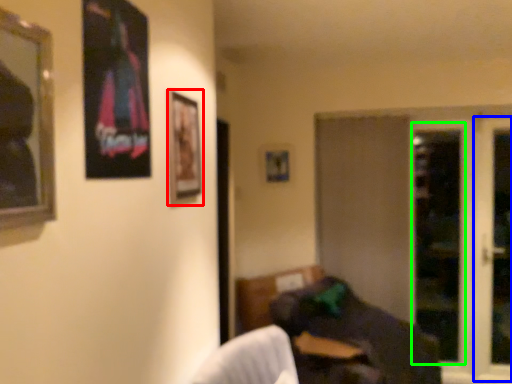
Question: Which object is positioned closest to picture frame (highlighted by a red box)? Select from screen door (highlighted by a blue box) and screen door (highlighted by a green box).

Choices:
 (A) screen door
 (B) screen door

Answer: (B)